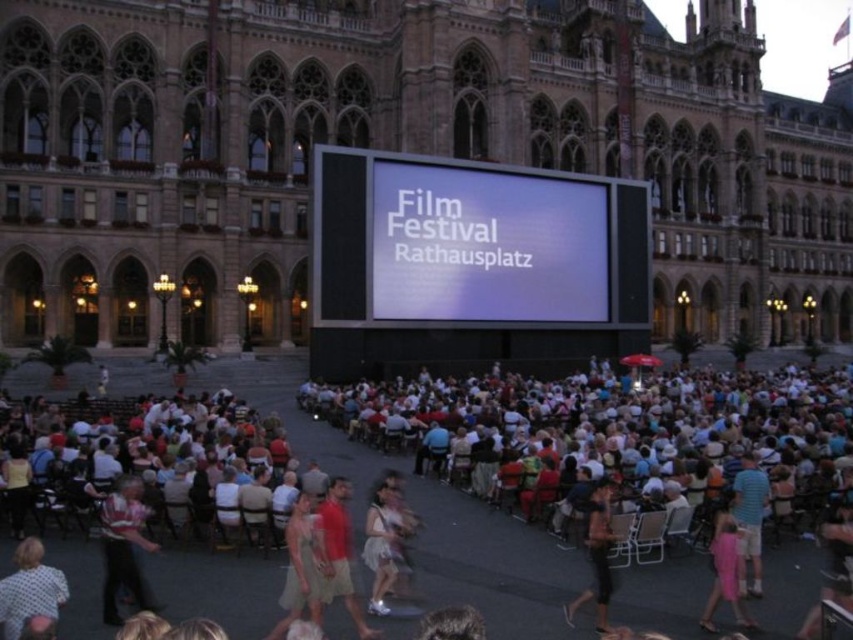
You are a photographer at the film festival event. You want to take a photo of both the white cotton dress at center and the pink fabric dress at lower right. However, you need to ensure that neither dress is blocking the other in the photo. Based on their positions, which dress should you position closer to the camera to achieve this?

To ensure neither the white cotton dress at center nor the pink fabric dress at lower right blocks the other, position the white cotton dress at center closer to the camera since it is in front of the pink fabric dress at lower right.

You are a photographer at the film festival event. You need to capture a photo of both the matte black dress at center and the white cotton dress at center. Which dress should you focus on first to ensure both are in frame?

The matte black dress at center is located above the white cotton dress at center, so you should focus on the white cotton dress at center first to ensure both are in frame.